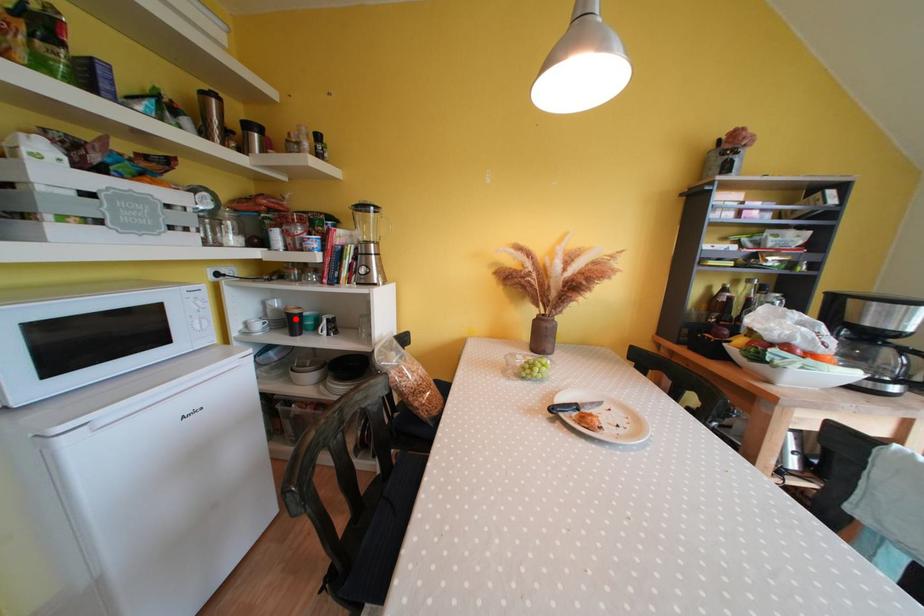
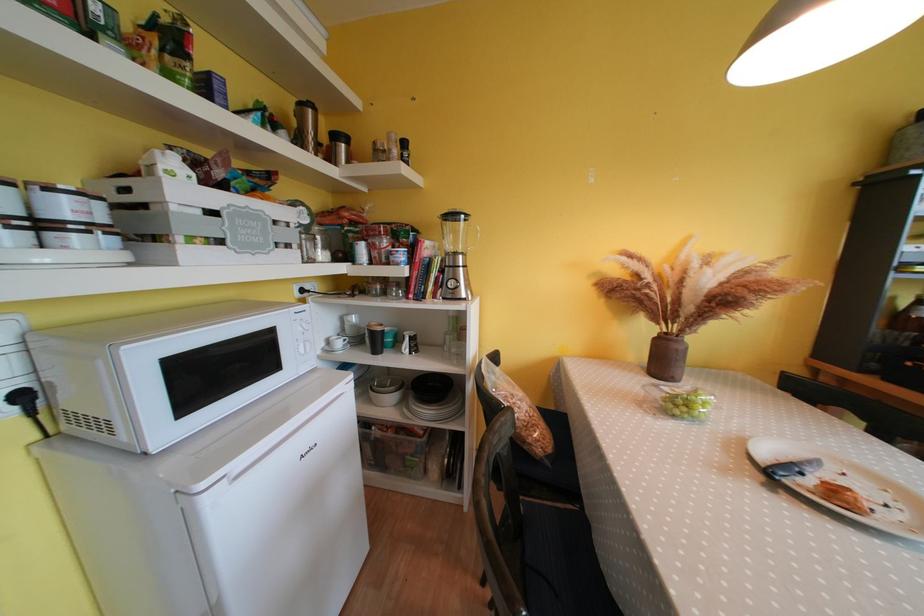
The point at the highlighted location is marked in the first image. Where is the corresponding point in the second image?

(379, 337)